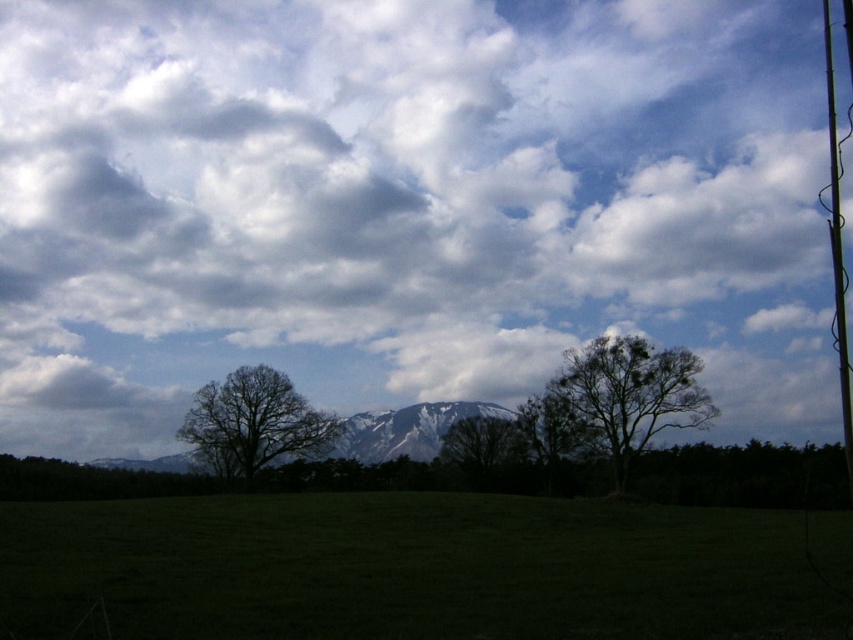
Is point (236, 42) closer to camera compared to point (691, 376)?

No, (236, 42) is further to viewer.

Does cloudy sky at upper center appear under dark brown bark tree at right?

Incorrect, cloudy sky at upper center is not positioned below dark brown bark tree at right.

Does point (691, 122) lie behind point (576, 381)?

Yes, it is behind point (576, 381).

At what (x,y) coordinates should I click in order to perform the action: click on cloudy sky at upper center. Please return your answer as a coordinate pair (x, y). The height and width of the screenshot is (640, 853). Looking at the image, I should click on (404, 205).

Between point (131, 608) and point (418, 451), which one is positioned in front?

Positioned in front is point (131, 608).

Find the location of a particular element. Image resolution: width=853 pixels, height=640 pixels. green grassy field at lower center is located at coordinates (409, 570).

Does point (643, 588) come behind point (413, 445)?

No, (643, 588) is in front of (413, 445).

What are the coordinates of `green grassy field at lower center` in the screenshot? It's located at (409, 570).

How distant is bare branches tree at center from snowy rock mountain at center?

bare branches tree at center and snowy rock mountain at center are 10.45 meters apart from each other.

Can you confirm if bare branches tree at center is wider than snowy rock mountain at center?

Incorrect, bare branches tree at center's width does not surpass snowy rock mountain at center's.

Who is more distant from viewer, (294, 417) or (161, 465)?

The point (161, 465) is more distant.

At what (x,y) coordinates should I click in order to perform the action: click on bare branches tree at center. Please return your answer as a coordinate pair (x, y). The image size is (853, 640). Looking at the image, I should click on (254, 422).